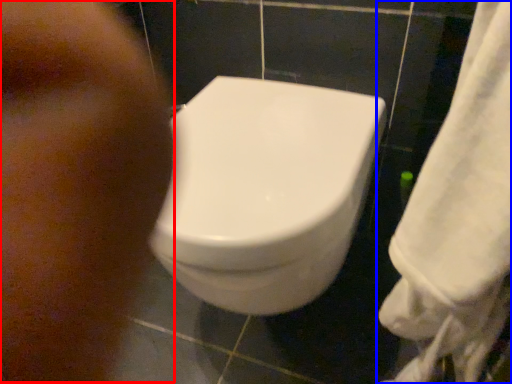
Question: Which object appears farthest to the camera in this image, face (highlighted by a red box) or towel (highlighted by a blue box)?

Choices:
 (A) face
 (B) towel

Answer: (A)